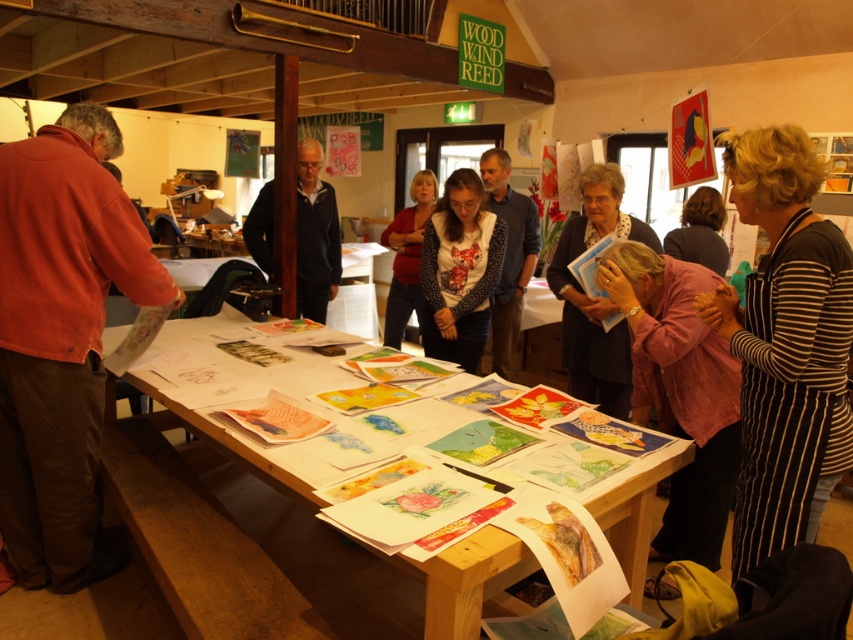
Where is `matte red shirt at left`? This screenshot has height=640, width=853. matte red shirt at left is located at coordinates (61, 339).

Which is more to the left, matte red shirt at left or dark blue sweater at center?

matte red shirt at left is more to the left.

The height and width of the screenshot is (640, 853). I want to click on matte red shirt at left, so click(x=61, y=339).

The width and height of the screenshot is (853, 640). Identify the location of matte red shirt at left. (61, 339).

Who is more forward, (462, 209) or (338, 273)?

Point (462, 209)

Which is above, white dotted shirt at center or dark blue sweater at center?

dark blue sweater at center

Is point (486, 310) farther from camera compared to point (325, 216)?

No, it is not.

Identify the location of white dotted shirt at center. (459, 272).

Who is more distant from viewer, (59, 586) or (689, 256)?

Point (689, 256)

Which of these two, matte red shirt at left or dark brown hair at center, stands shorter?

dark brown hair at center

In order to click on matte red shirt at left in this screenshot , I will do `click(61, 339)`.